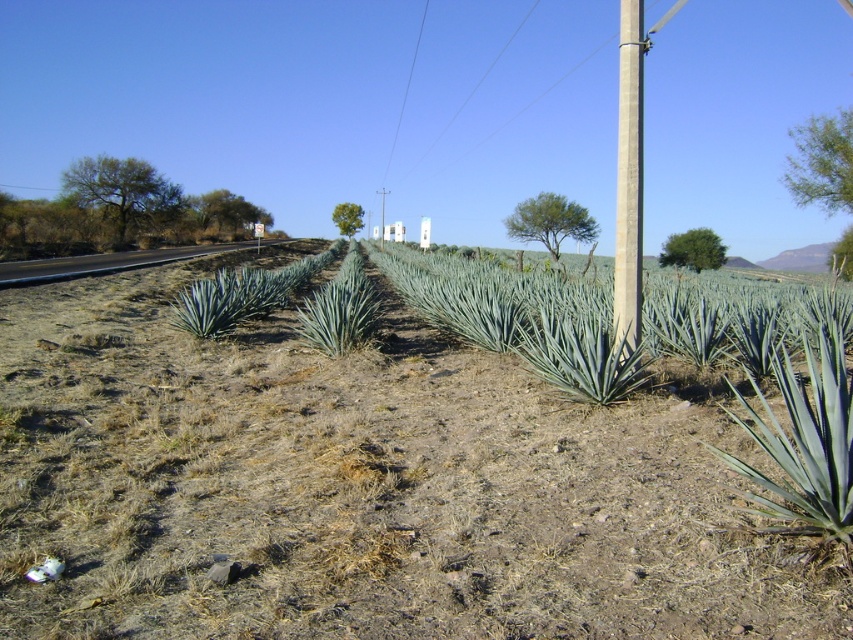
Question: Which of the following is the farthest from the observer?

Choices:
 (A) (640, 49)
 (B) (444, 557)

Answer: (A)

Question: Does green leafy grass at center appear on the right side of gray concrete pole at right?

Choices:
 (A) no
 (B) yes

Answer: (A)

Question: Does green leafy grass at center have a smaller size compared to gray concrete pole at right?

Choices:
 (A) no
 (B) yes

Answer: (B)

Question: Can you confirm if green leafy grass at center is positioned to the left of gray concrete pole at right?

Choices:
 (A) yes
 (B) no

Answer: (A)